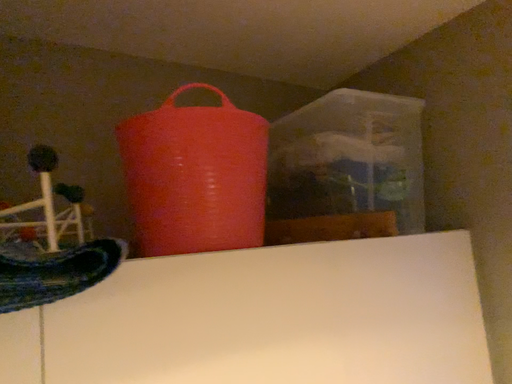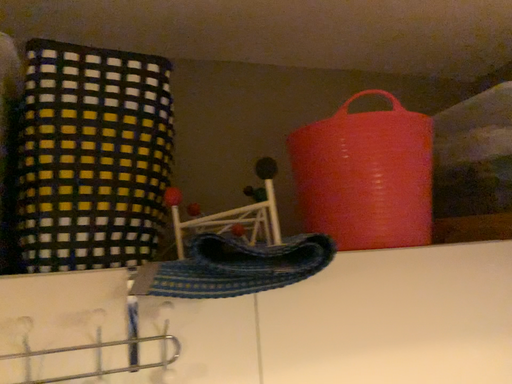
Question: Which way did the camera rotate in the video?

Choices:
 (A) rotated right
 (B) rotated left

Answer: (B)